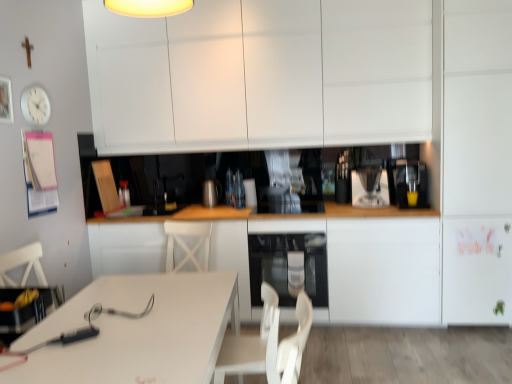
Locate an element on the screen. The image size is (512, 384). free space that is to the left of yellow matte cup at right is located at coordinates (393, 201).